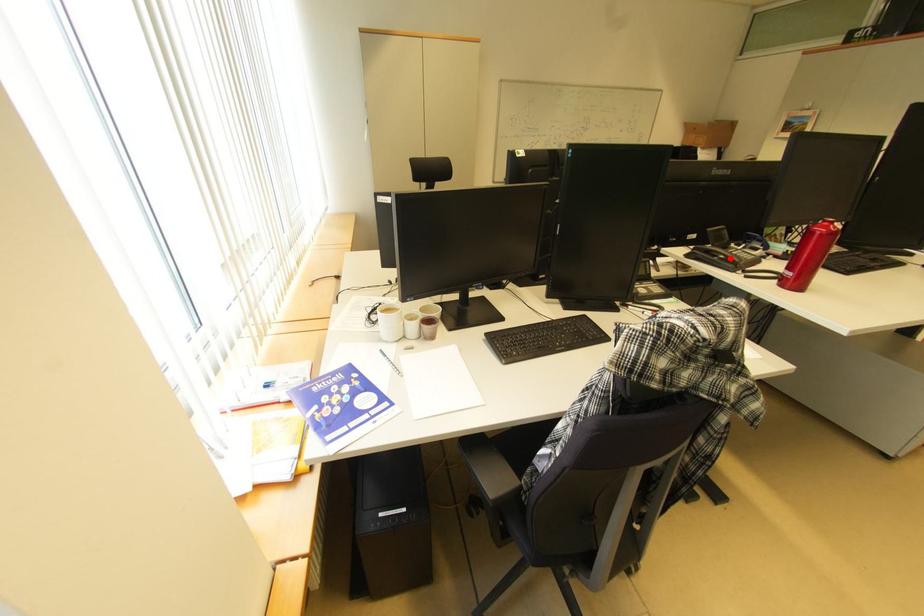
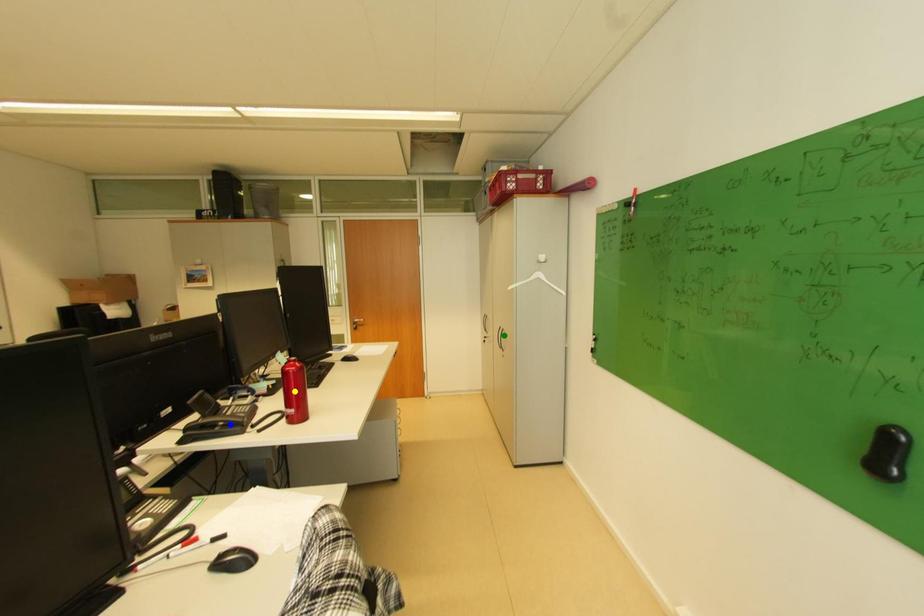
Question: I am providing you with two images of the same scene from different viewpoints. A red point is marked on the first image. You are given multiple points on the second image. Can you choose the point in image 2 that corresponds to the point in image 1?

Choices:
 (A) yellow point
 (B) blue point
 (C) green point

Answer: (B)